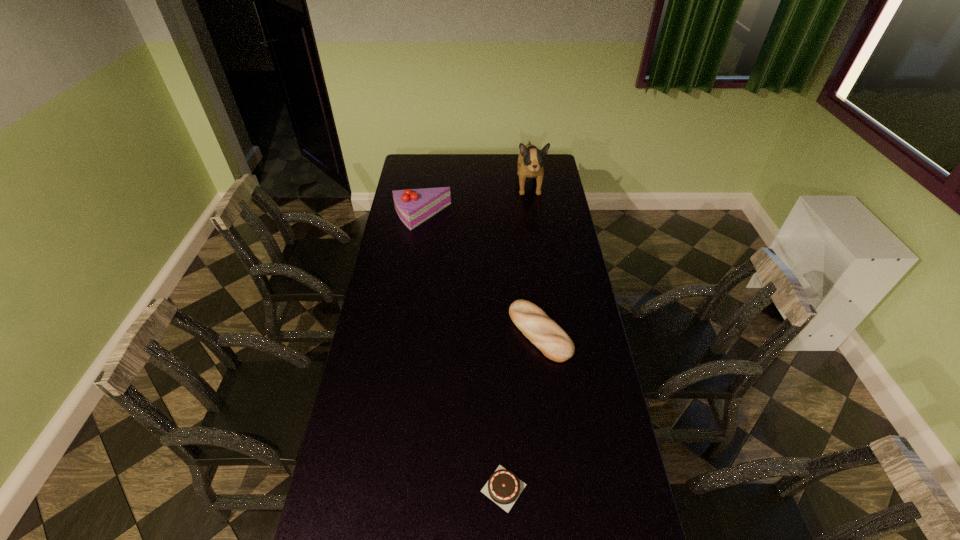
Where is `puppy`? The height and width of the screenshot is (540, 960). puppy is located at coordinates (530, 161).

Where is `the tallest object`? the tallest object is located at coordinates (530, 161).

Locate an element on the screen. The height and width of the screenshot is (540, 960). the second farthest object is located at coordinates (414, 206).

Locate an element on the screen. This screenshot has height=540, width=960. cake is located at coordinates (414, 206).

Where is `the second shortest object`? The height and width of the screenshot is (540, 960). the second shortest object is located at coordinates (542, 331).

The height and width of the screenshot is (540, 960). I want to click on the third farthest object, so [542, 331].

Find the location of a particular element. the nearest object is located at coordinates (503, 487).

I want to click on the shortest object, so coord(503,487).

At what (x,y) coordinates should I click in order to perform the action: click on free spot located at the face of the farthest object. Please return your answer as a coordinate pair (x, y). Looking at the image, I should click on (536, 230).

The image size is (960, 540). I want to click on vacant space located on the back of the second farthest object, so click(429, 166).